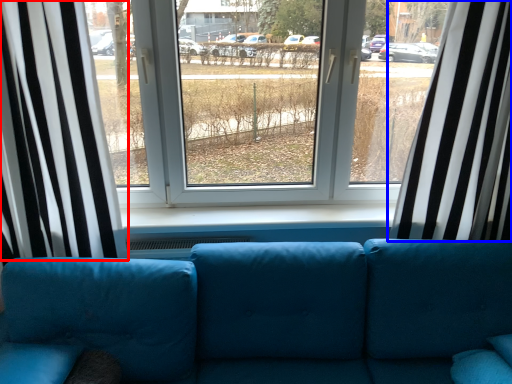
Question: Which point is closer to the camera, curtain (highlighted by a red box) or curtain (highlighted by a blue box)?

Choices:
 (A) curtain
 (B) curtain

Answer: (A)